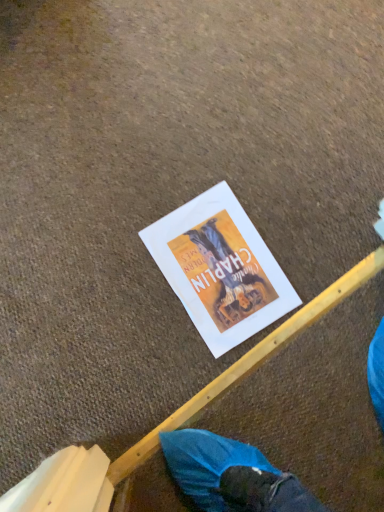
The height and width of the screenshot is (512, 384). What are the coordinates of `vacant space in matte paper flyer at center (from a real-world perspective)` in the screenshot? It's located at (219, 269).